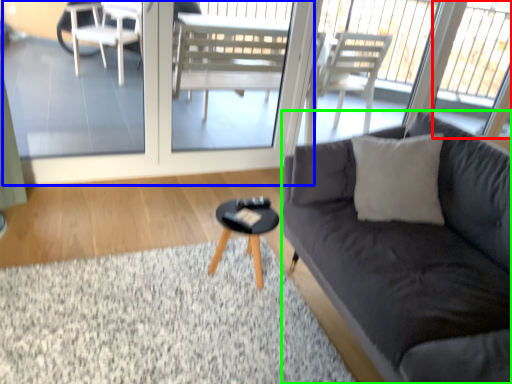
Question: Considering the real-world distances, which object is closest to window (highlighted by a red box)? screen door (highlighted by a blue box) or studio couch (highlighted by a green box).

Choices:
 (A) screen door
 (B) studio couch

Answer: (A)